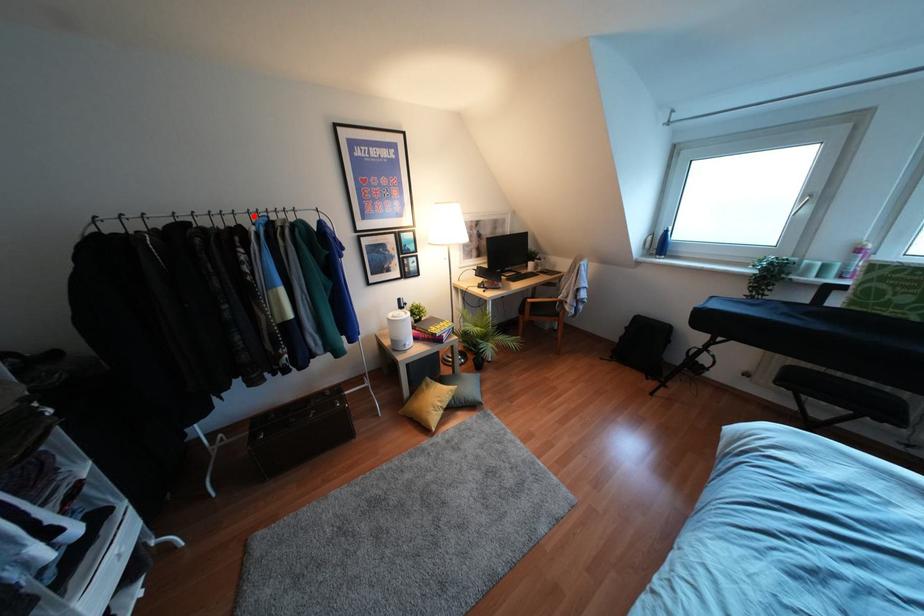
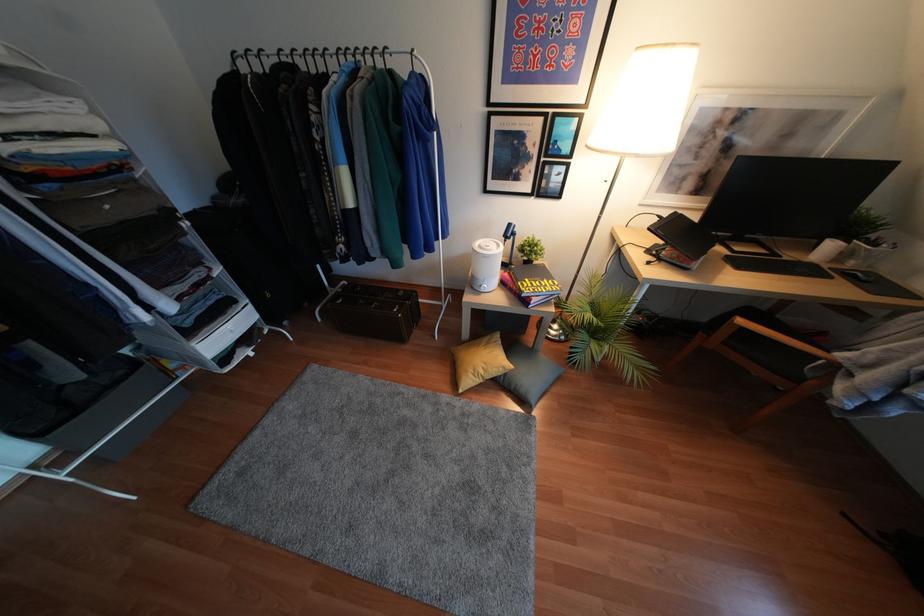
Find the pixel in the second image that matches the highlighted location in the first image.

(342, 59)